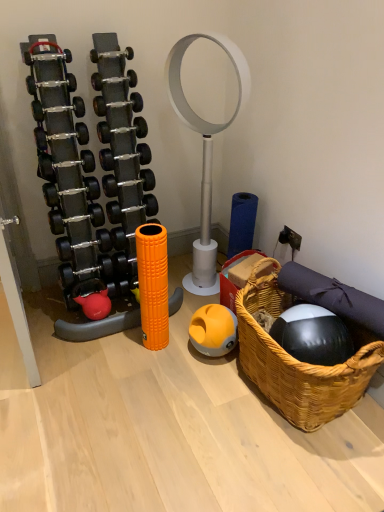
Question: Does orange rubber ball at center have a smaller size compared to rubberized red kettlebell at lower left?

Choices:
 (A) no
 (B) yes

Answer: (A)

Question: Can you confirm if orange rubber ball at center is bigger than rubberized red kettlebell at lower left?

Choices:
 (A) yes
 (B) no

Answer: (A)

Question: Is the position of orange rubber ball at center less distant than that of rubberized red kettlebell at lower left?

Choices:
 (A) yes
 (B) no

Answer: (A)

Question: Is orange rubber ball at center turned away from rubberized red kettlebell at lower left?

Choices:
 (A) yes
 (B) no

Answer: (B)

Question: Is orange rubber ball at center at the right side of rubberized red kettlebell at lower left?

Choices:
 (A) no
 (B) yes

Answer: (B)

Question: Would you say woven brown basket at lower right is inside or outside rubberized red kettlebell at lower left?

Choices:
 (A) outside
 (B) inside

Answer: (A)

Question: Relative to rubberized red kettlebell at lower left, is woven brown basket at lower right in front or behind?

Choices:
 (A) behind
 (B) front

Answer: (B)

Question: In terms of width, does woven brown basket at lower right look wider or thinner when compared to rubberized red kettlebell at lower left?

Choices:
 (A) thin
 (B) wide

Answer: (B)

Question: From their relative heights in the image, would you say woven brown basket at lower right is taller or shorter than rubberized red kettlebell at lower left?

Choices:
 (A) tall
 (B) short

Answer: (A)

Question: Considering the positions of orange rubber ball at center and matte black dumbbell at center in the image, is orange rubber ball at center taller or shorter than matte black dumbbell at center?

Choices:
 (A) tall
 (B) short

Answer: (A)

Question: Would you say orange rubber ball at center is inside or outside matte black dumbbell at center?

Choices:
 (A) inside
 (B) outside

Answer: (B)

Question: Is orange rubber ball at center wider or thinner than matte black dumbbell at center?

Choices:
 (A) thin
 (B) wide

Answer: (B)

Question: Does point (226, 326) appear closer or farther from the camera than point (97, 113)?

Choices:
 (A) closer
 (B) farther

Answer: (B)

Question: From a real-world perspective, is rubberized red kettlebell at lower left above or below woven brown basket at lower right?

Choices:
 (A) below
 (B) above

Answer: (A)

Question: Visually, is rubberized red kettlebell at lower left positioned to the left or to the right of woven brown basket at lower right?

Choices:
 (A) right
 (B) left

Answer: (B)